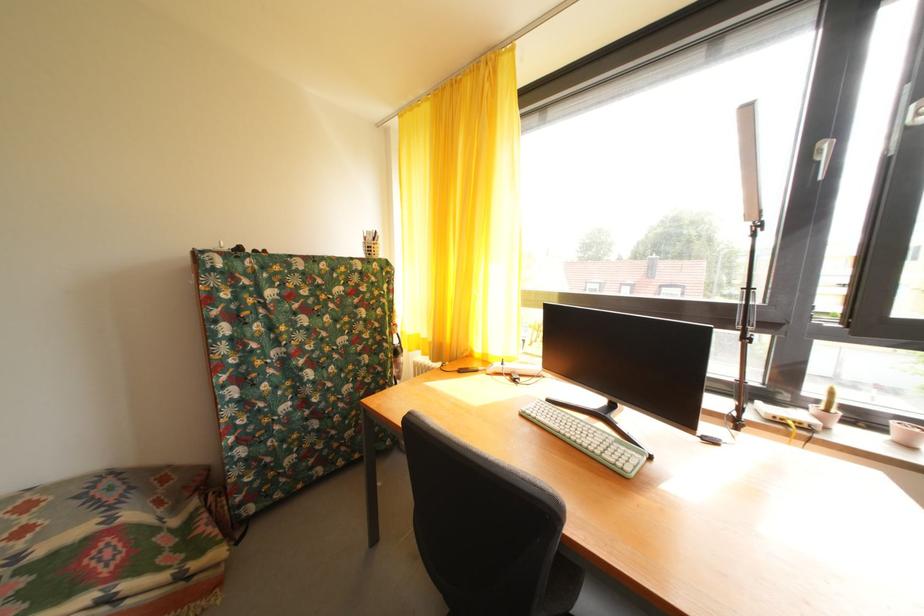
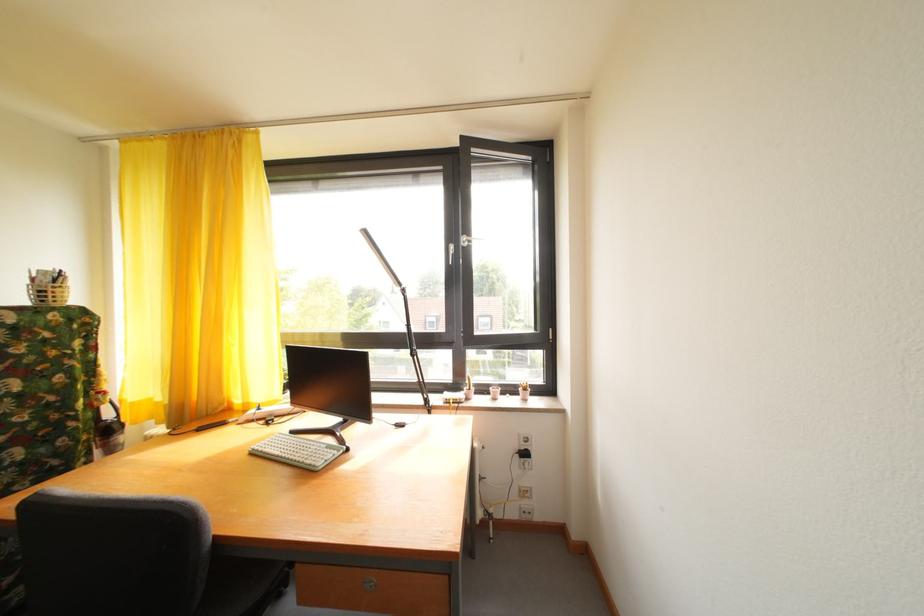
In the second image, find the point that corresponds to point 373,245 in the first image.

(43, 286)